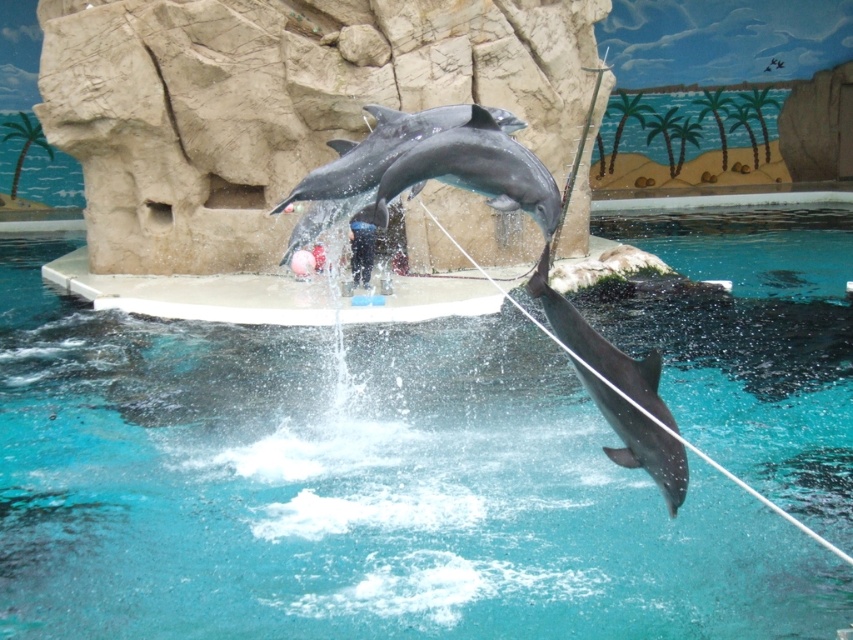
Describe the element at coordinates (599, 346) in the screenshot. I see `shiny gray dolphin at lower right` at that location.

Is shiny gray dolphin at lower right in front of black rubber trainer at center?

That is True.

Is point (645, 444) positioned before point (360, 256)?

Yes, point (645, 444) is in front of point (360, 256).

Find the location of a particular element. shiny gray dolphin at lower right is located at coordinates (599, 346).

Does point (326, 624) come farther from viewer compared to point (619, 435)?

No, it is in front of (619, 435).

Does clear blue water at center come in front of shiny gray dolphin at lower right?

Yes, it is.

Between point (704, 268) and point (579, 348), which one is positioned in front?

Point (579, 348) is more forward.

The height and width of the screenshot is (640, 853). What are the coordinates of `clear blue water at center` in the screenshot? It's located at (351, 488).

Consider the image. Does clear blue water at center have a lesser width compared to black rubber trainer at center?

Incorrect, clear blue water at center's width is not less than black rubber trainer at center's.

Does clear blue water at center have a larger size compared to black rubber trainer at center?

Yes.

Who is more forward, (x=583, y=531) or (x=350, y=237)?

Point (x=583, y=531) is in front.

At what (x,y) coordinates should I click in order to perform the action: click on clear blue water at center. Please return your answer as a coordinate pair (x, y). Image resolution: width=853 pixels, height=640 pixels. Looking at the image, I should click on (351, 488).